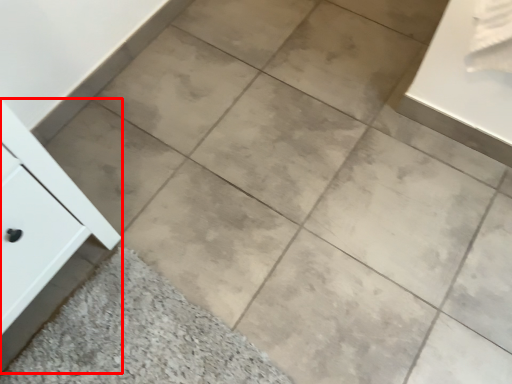
Question: From the image's perspective, what is the correct spatial positioning of cabinetry (annotated by the red box) in reference to ceramic tile?

Choices:
 (A) below
 (B) above

Answer: (B)